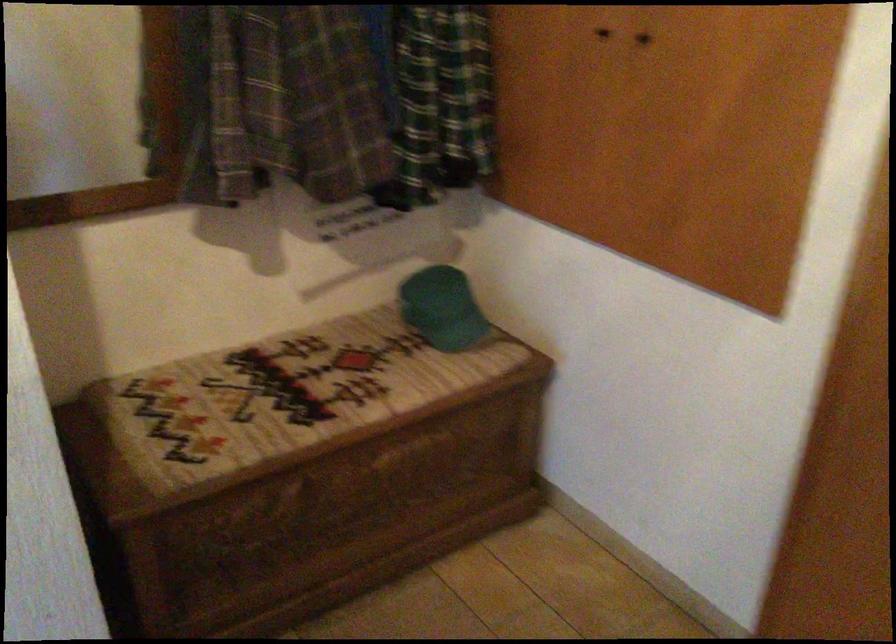
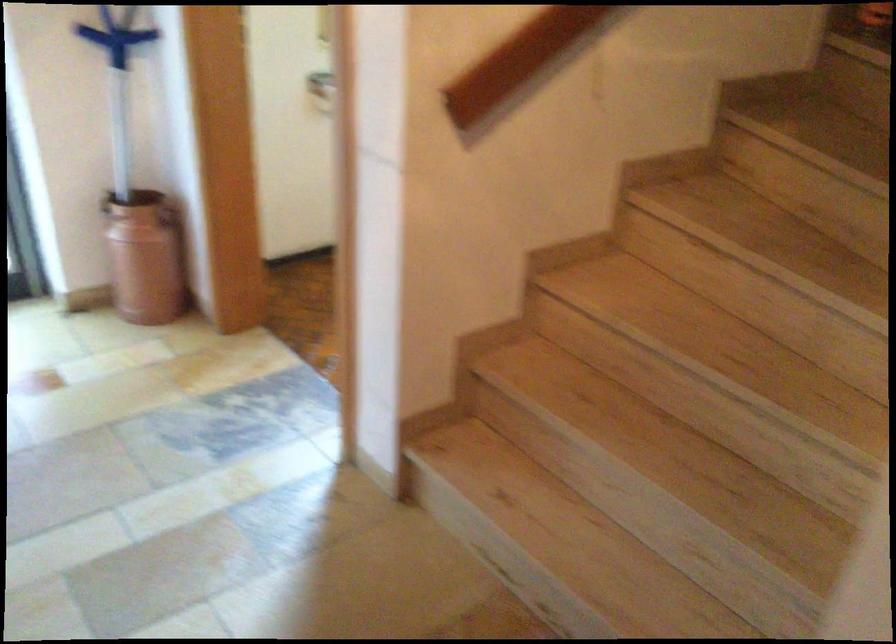
The images are taken continuously from a first-person perspective. In which direction is your viewpoint rotating?

The rotation direction of the camera is left-down.